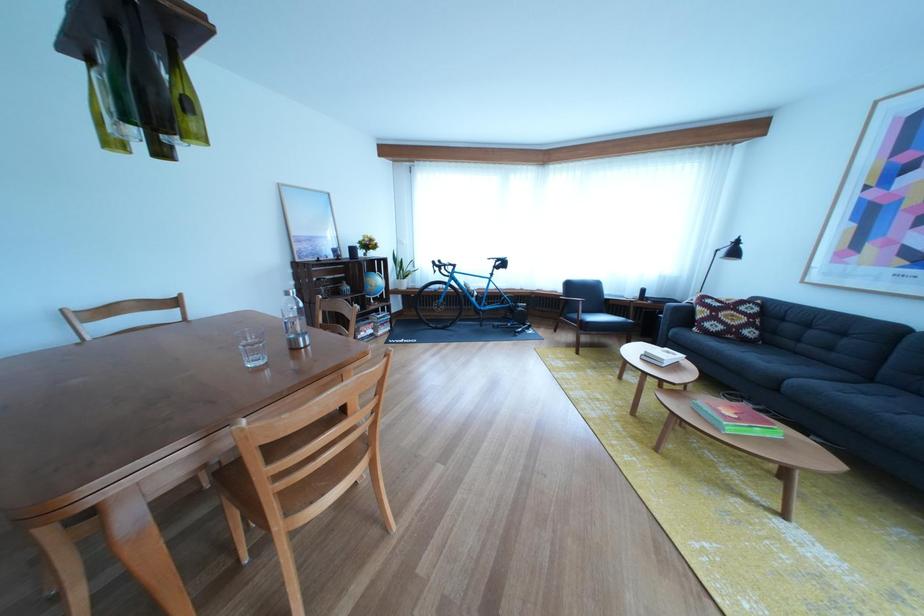
Image resolution: width=924 pixels, height=616 pixels. What do you see at coordinates (787, 368) in the screenshot?
I see `the dark sofa sitting surface` at bounding box center [787, 368].